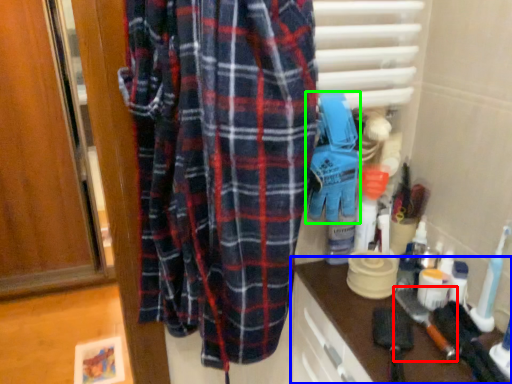
Question: Which is nearer to the brush (highlighted by a red box)? counter (highlighted by a blue box) or toy (highlighted by a green box).

Choices:
 (A) counter
 (B) toy

Answer: (A)